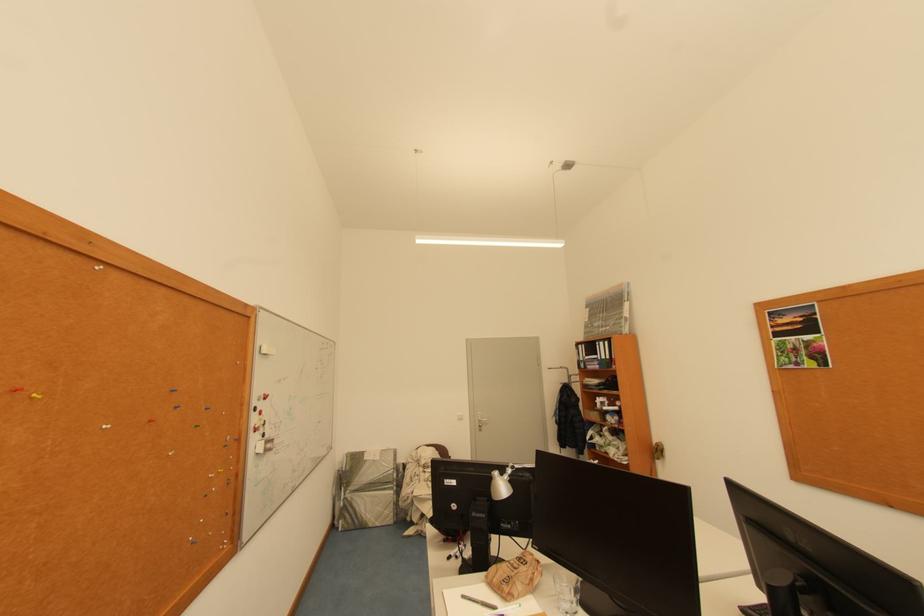
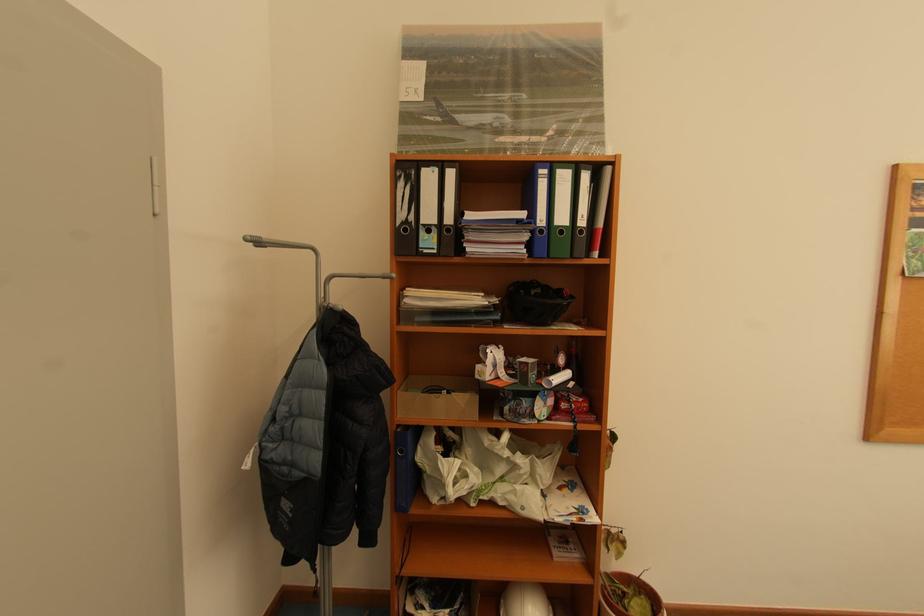
Find the pixel in the second image that matches point 586,360 in the first image.

(409, 217)